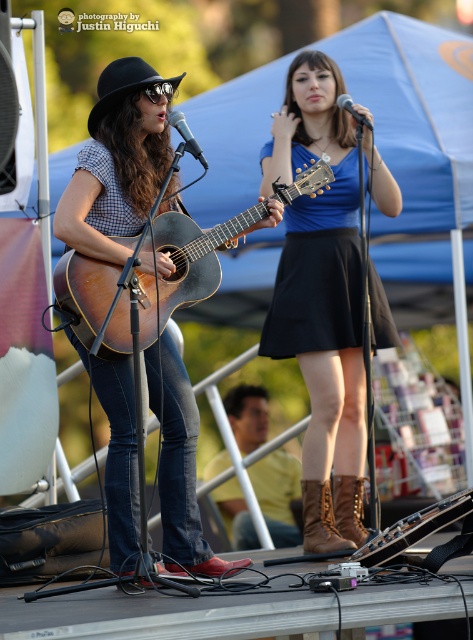
You are a stagehand needing to place a 30 inch wide decorative banner between the blue suede skirt at center and the metallic silver microphone at upper center. Can the banner fit without overlapping either object?

The distance between the blue suede skirt at center and the metallic silver microphone at upper center is 29.60 inches. Since the banner is 30 inches wide, it cannot fit without overlapping one of the objects.